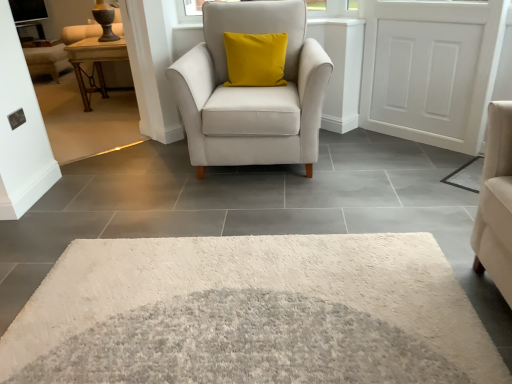
Question: Would you consider matte white armchair at center to be distant from white shaggy rug at lower right?

Choices:
 (A) no
 (B) yes

Answer: (B)

Question: Is matte white armchair at center positioned with its back to white shaggy rug at lower right?

Choices:
 (A) yes
 (B) no

Answer: (B)

Question: From the image's perspective, does matte white armchair at center appear lower than white shaggy rug at lower right?

Choices:
 (A) no
 (B) yes

Answer: (A)

Question: Is the position of matte white armchair at center more distant than that of white shaggy rug at lower right?

Choices:
 (A) no
 (B) yes

Answer: (A)

Question: Is matte white armchair at center completely or partially outside of white shaggy rug at lower right?

Choices:
 (A) yes
 (B) no

Answer: (A)

Question: Does matte white armchair at center contain white shaggy rug at lower right?

Choices:
 (A) yes
 (B) no

Answer: (B)

Question: Is matte white armchair at center facing away from matte brown wooden couch at upper left?

Choices:
 (A) yes
 (B) no

Answer: (B)

Question: From the image's perspective, is matte white armchair at center above matte brown wooden couch at upper left?

Choices:
 (A) yes
 (B) no

Answer: (B)

Question: From the image's perspective, is matte white armchair at center located beneath matte brown wooden couch at upper left?

Choices:
 (A) no
 (B) yes

Answer: (B)

Question: Does matte white armchair at center come behind matte brown wooden couch at upper left?

Choices:
 (A) yes
 (B) no

Answer: (B)

Question: Considering the relative sizes of matte white armchair at center and matte brown wooden couch at upper left in the image provided, is matte white armchair at center bigger than matte brown wooden couch at upper left?

Choices:
 (A) no
 (B) yes

Answer: (B)

Question: Can we say matte white armchair at center lies outside matte brown wooden couch at upper left?

Choices:
 (A) yes
 (B) no

Answer: (A)

Question: From the image's perspective, would you say matte brown wooden couch at upper left is shown under matte white armchair at center?

Choices:
 (A) yes
 (B) no

Answer: (B)